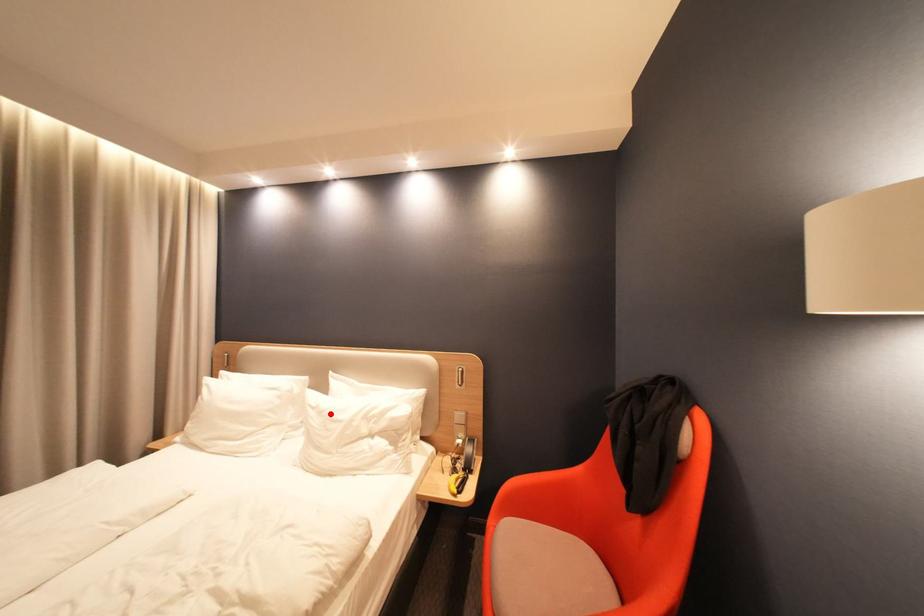
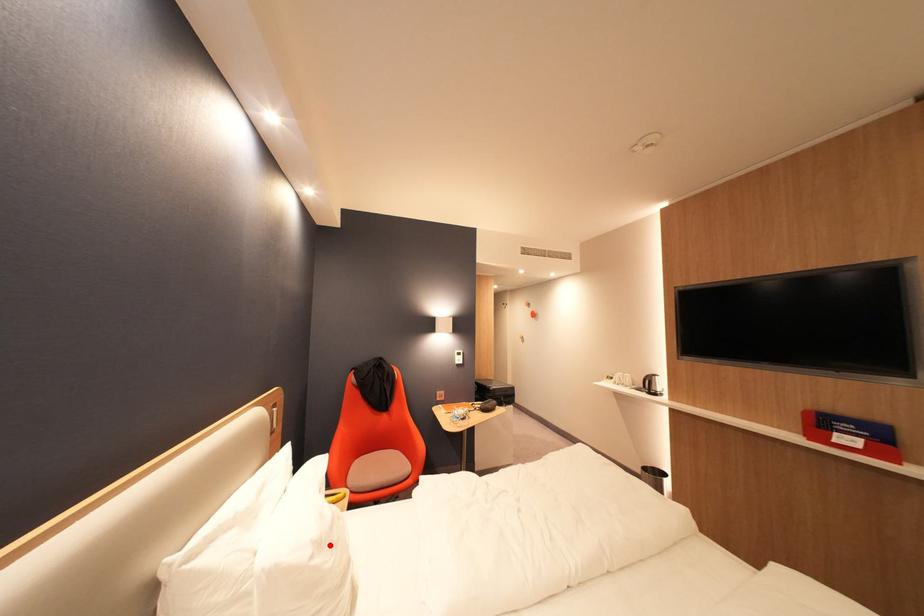
I am providing you with two images of the same scene from different viewpoints. A red point is marked on the first image and another point is marked on the second image. Does the point marked in image1 correspond to the same location as the one in image2?

Yes